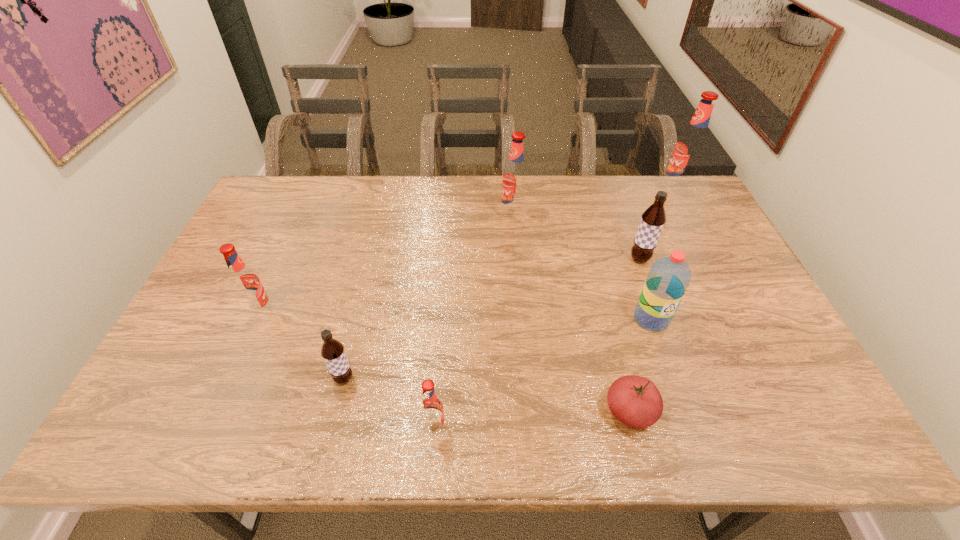
The image size is (960, 540). Find the location of `vacant space situated 0.110m on the right of the third red root beer from right to left`. vacant space situated 0.110m on the right of the third red root beer from right to left is located at coordinates (495, 427).

You are a GUI agent. You are given a task and a screenshot of the screen. Output one action in this format:
    pyautogui.click(x=<x>, y=<y>)
    Task: Click on the blank space located on the back of the left brown root beer
    Image resolution: width=960 pixels, height=540 pixels.
    Given the screenshot: What is the action you would take?
    pyautogui.click(x=368, y=283)

This screenshot has width=960, height=540. In order to click on vacant space located 0.290m on the back of the fourth object from right to left in this screenshot , I will do `click(601, 296)`.

Locate an element on the screen. This screenshot has height=540, width=960. root beer that is at the near edge is located at coordinates (431, 409).

What are the coordinates of `tomato that is at the near edge` in the screenshot? It's located at (635, 401).

Where is `object at the left edge`? The width and height of the screenshot is (960, 540). object at the left edge is located at coordinates click(x=245, y=283).

Locate an element on the screen. The image size is (960, 540). object situated at the right edge is located at coordinates (690, 148).

Find the location of a particular element. object positioned at the far right corner is located at coordinates (690, 148).

The image size is (960, 540). What are the coordinates of `vacant space at the far edge of the desktop` in the screenshot? It's located at (552, 207).

Identify the location of vacant position at the near edge of the desktop. The width and height of the screenshot is (960, 540). (731, 416).